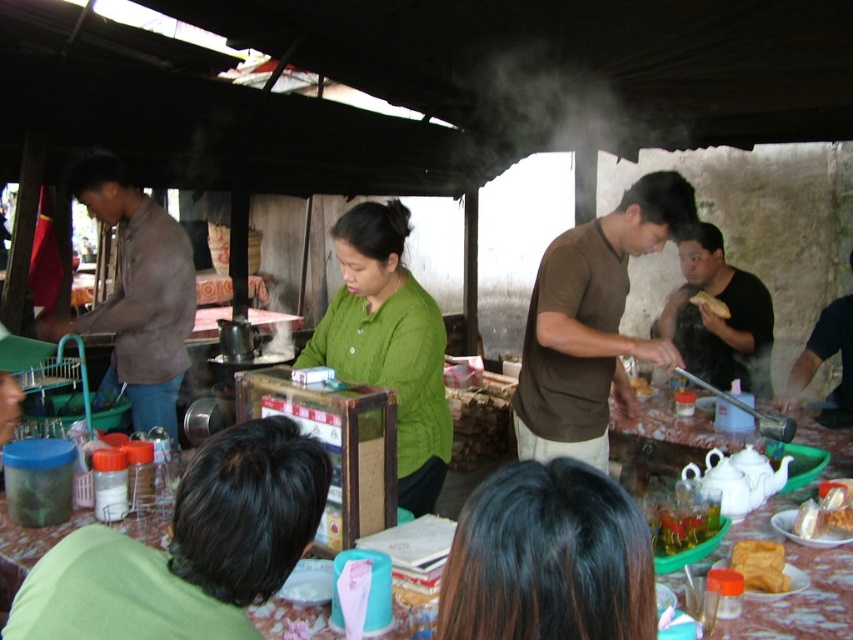
This screenshot has height=640, width=853. Identify the location of shiny brown hair at center. point(548,557).

Does point (527, 474) lie behind point (375, 250)?

No.

The width and height of the screenshot is (853, 640). Identify the location of shiny brown hair at center. (548, 557).

Consider the image. Is green knitted sweater at center positioned before yellow fried food at center?

That is True.

Identify the location of green knitted sweater at center. Image resolution: width=853 pixels, height=640 pixels. (387, 342).

Which of these two, golden fried pastry at lower right or golden crispy pastry at lower right, stands shorter?

With less height is golden fried pastry at lower right.

Does point (759, 547) lie in front of point (830, 506)?

Yes.

Find the location of `golden fried pastry at lower right`. golden fried pastry at lower right is located at coordinates (759, 564).